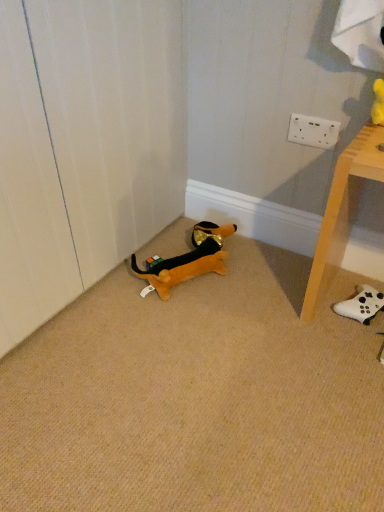
Question: From the image's perspective, is soft plush dog at lower left, which is the second toy from right to left, above or below white wood table at lower right?

Choices:
 (A) below
 (B) above

Answer: (A)

Question: In the image, is soft plush dog at lower left, which is the second toy from right to left, on the left side or the right side of white wood table at lower right?

Choices:
 (A) right
 (B) left

Answer: (B)

Question: Which is farther from the white matte controller at lower right, the 2th toy viewed from the left?

Choices:
 (A) soft plush dog at lower left, which is the second toy from right to left
 (B) white wood table at lower right

Answer: (A)

Question: Considering the real-world distances, which object is farthest from the white wood table at lower right?

Choices:
 (A) soft plush dog at lower left, which is the second toy from right to left
 (B) white matte controller at lower right, which appears as the 1th toy when viewed from the right

Answer: (A)